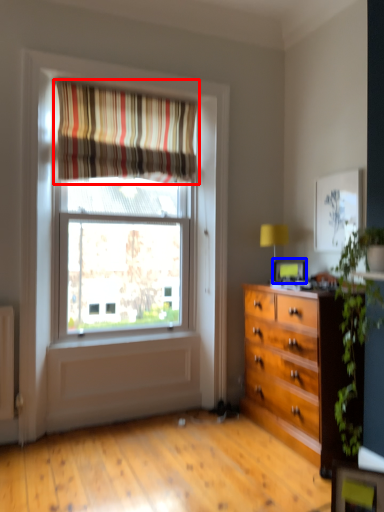
Question: Among these objects, which one is farthest to the camera, curtain (highlighted by a red box) or picture frame (highlighted by a blue box)?

Choices:
 (A) curtain
 (B) picture frame

Answer: (B)